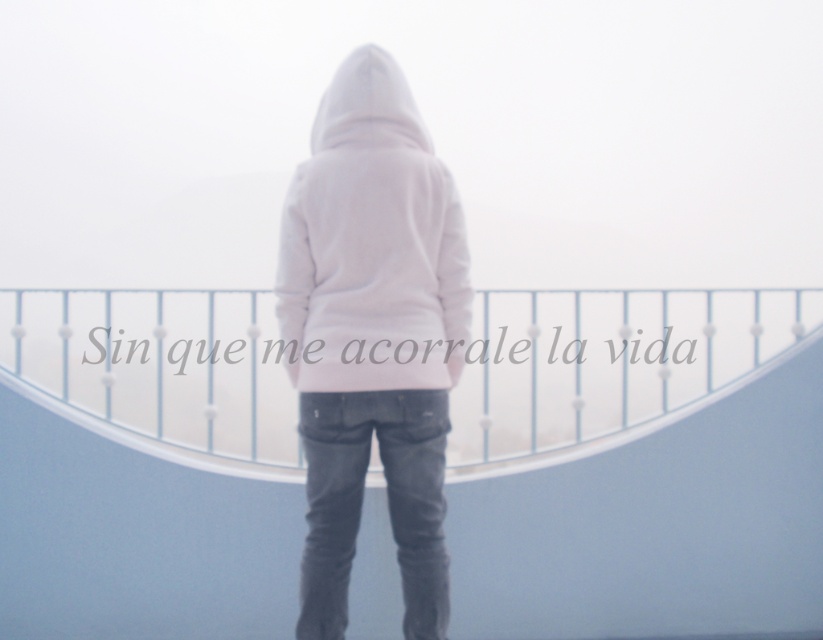
You are designing a new clothing line and want to create a hoodie that fits perfectly over another hoodie. You have two hoodies in the image, a white fleece hoodie at center and a white matte hoodie at center. Which hoodie should be the outer layer to ensure the inner one doesn t get stretched out?

The white fleece hoodie at center is wider than the white matte hoodie at center, so the white fleece hoodie at center should be the outer layer to prevent the inner white matte hoodie at center from stretching.

You are a photographer trying to capture the scene from the same angle. If you want to ensure both the white plastic railing at center and the white matte hoodie at center are fully visible in your shot, which object should you focus on first to frame the composition properly?

The white plastic railing at center is taller than the white matte hoodie at center, so you should focus on framing the white plastic railing at center first to ensure its full height is captured before adjusting for the hoodie.

You are a photographer trying to capture the scene from the same angle. You notice the white plastic railing at center and the white fleece hoodie at center. Which object should you focus on first if you want to ensure both are in the frame without moving the camera?

The white plastic railing at center is to the right of the white fleece hoodie at center, so you should focus on the white fleece hoodie at center first to ensure both are in the frame without moving the camera.